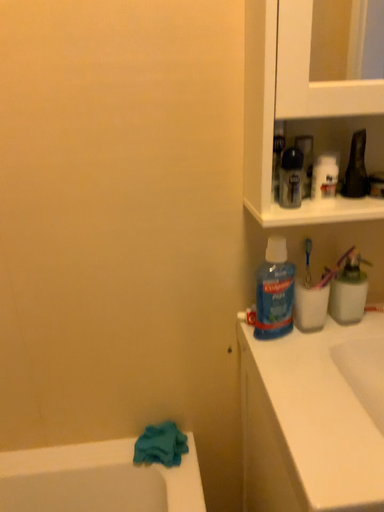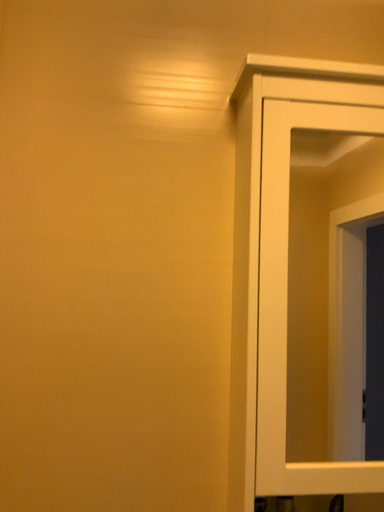
Question: How did the camera likely rotate when shooting the video?

Choices:
 (A) rotated upward
 (B) rotated downward

Answer: (A)